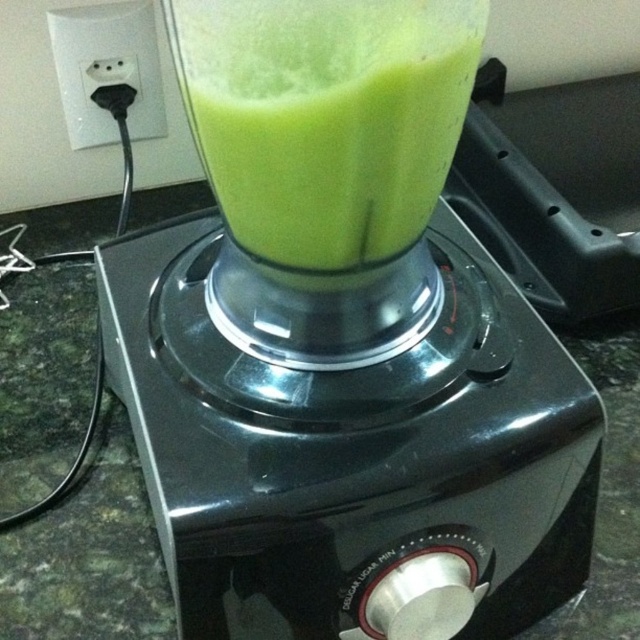
Does point (387, 253) come farther from viewer compared to point (147, 81)?

No, it is not.

Is green matte liquid at center positioned in front of black plastic plug at upper left?

That is True.

What do you see at coordinates (324, 116) in the screenshot? This screenshot has width=640, height=640. I see `green matte liquid at center` at bounding box center [324, 116].

Find the location of `green matte liquid at center`. green matte liquid at center is located at coordinates (324, 116).